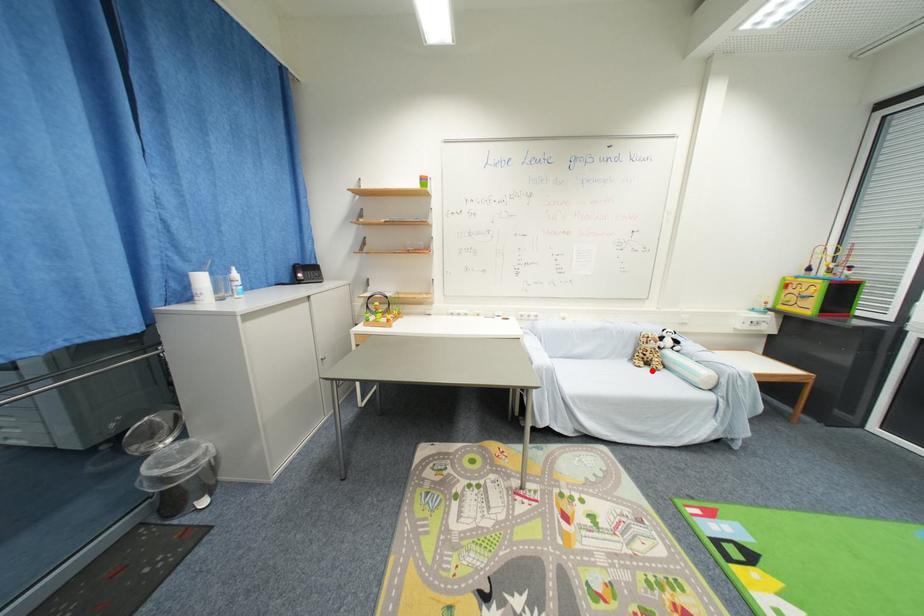
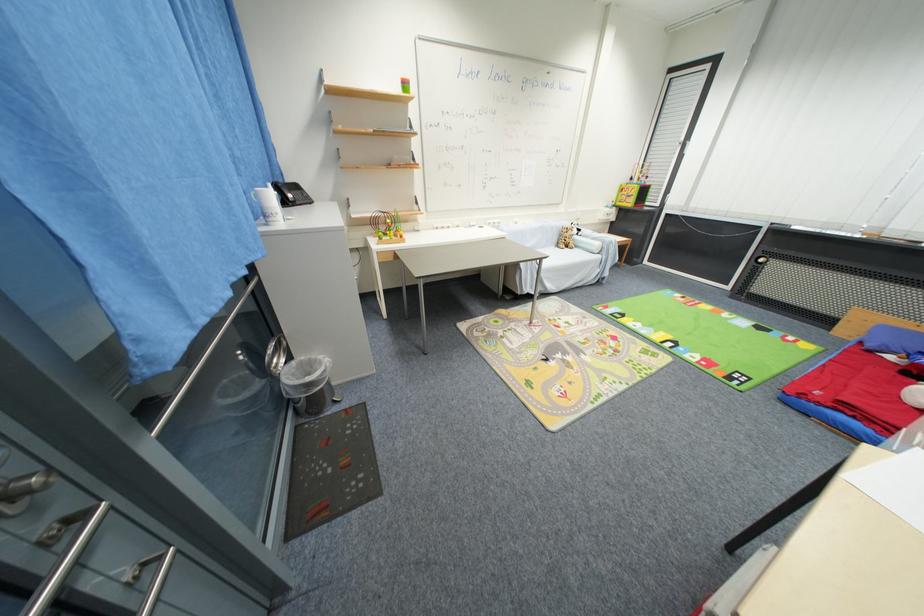
In the second image, find the point that corresponds to the highlighted location in the first image.

(572, 251)